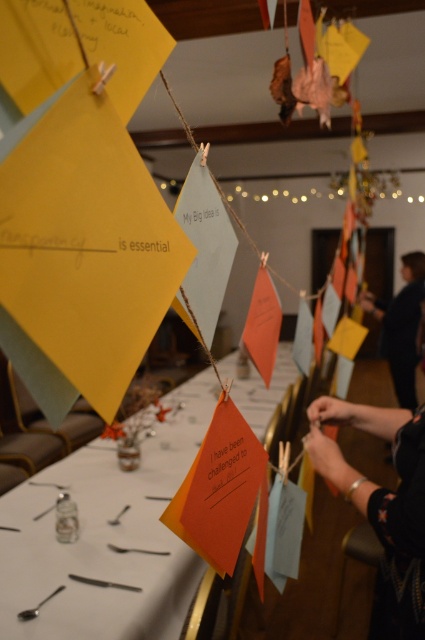
You are a guest at this event and need to place a small note on the table between the black fabric hand at lower right and the dark blue fabric at upper right. Based on their positions, where should you place the note so it is closer to the taller object?

The dark blue fabric at upper right is taller than the black fabric hand at lower right. Place the note closer to the dark blue fabric at upper right to ensure it is near the taller object.

You are a participant in the workshop and need to reach the orange paper tag at center from where the black fabric hand at lower right is positioned. Can you comfortably extend your arm to touch both objects without moving your body?

The orange paper tag at center and black fabric hand at lower right are 1.15 meters apart from each other. Since the average human arm span is about 1.5 meters, you can comfortably extend your arm to touch both objects without moving your body.